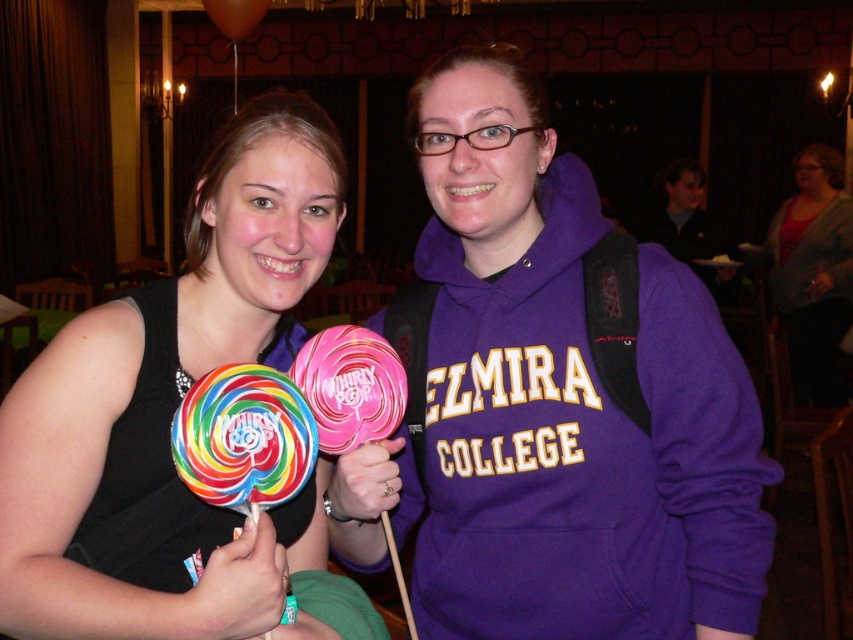
Question: Is matte black dress at left above rainbow lollipop at center?

Choices:
 (A) yes
 (B) no

Answer: (A)

Question: Estimate the real-world distances between objects in this image. Which object is farther from the matte pink lollipop at center?

Choices:
 (A) purple matte hoodie at center
 (B) matte black dress at left

Answer: (A)

Question: Which object is the closest to the matte pink lollipop at center?

Choices:
 (A) matte black dress at left
 (B) purple matte hoodie at center

Answer: (A)

Question: Can you confirm if matte black dress at left is wider than rainbow lollipop at center?

Choices:
 (A) no
 (B) yes

Answer: (B)

Question: From the image, what is the correct spatial relationship of rainbow lollipop at center in relation to matte pink lollipop at center?

Choices:
 (A) right
 (B) left

Answer: (B)

Question: Considering the real-world distances, which object is closest to the matte pink lollipop at center?

Choices:
 (A) rainbow lollipop at center
 (B) matte black dress at left

Answer: (A)